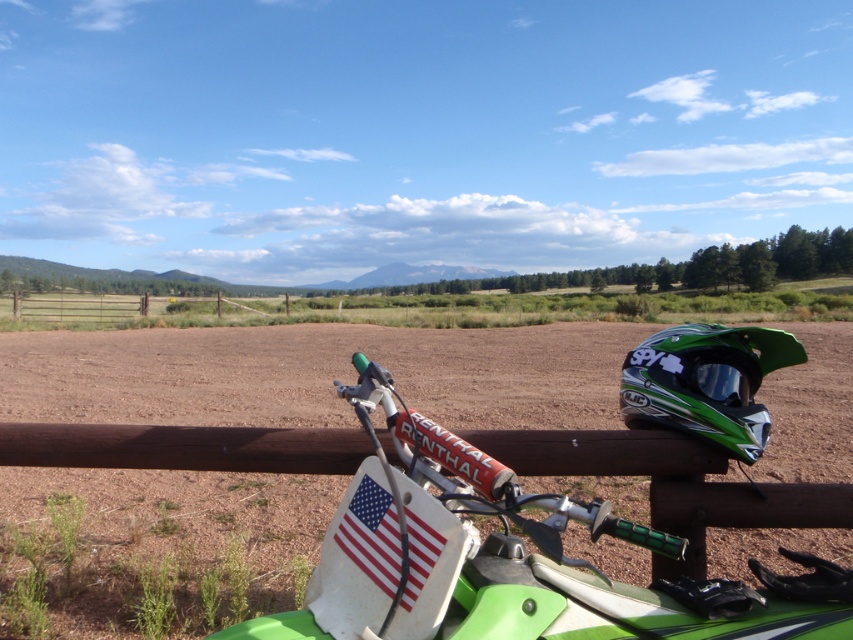
Question: Does green matte helmet at upper right have a lesser width compared to american flag sticker at lower center?

Choices:
 (A) no
 (B) yes

Answer: (A)

Question: Which object appears closest to the camera in this image?

Choices:
 (A) green matte helmet at upper right
 (B) american flag sticker at lower center
 (C) green matte motorcycle handlebars at center

Answer: (C)

Question: Among these objects, which one is farthest from the camera?

Choices:
 (A) green matte helmet at upper right
 (B) american flag sticker at lower center

Answer: (A)

Question: Estimate the real-world distances between objects in this image. Which object is farther from the green matte motorcycle handlebars at center?

Choices:
 (A) green matte helmet at upper right
 (B) american flag sticker at lower center

Answer: (A)

Question: Is green matte motorcycle handlebars at center closer to camera compared to american flag sticker at lower center?

Choices:
 (A) no
 (B) yes

Answer: (B)

Question: Is green matte motorcycle handlebars at center to the right of green matte helmet at upper right from the viewer's perspective?

Choices:
 (A) no
 (B) yes

Answer: (A)